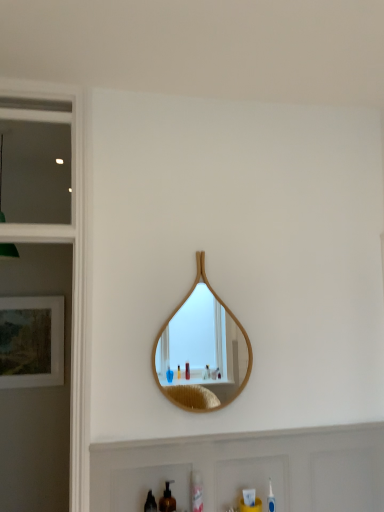
Question: Does point (200, 339) appear closer or farther from the camera than point (167, 501)?

Choices:
 (A) farther
 (B) closer

Answer: (A)

Question: From their relative heights in the image, would you say wooden mirror at center is taller or shorter than brown matte soap dispenser at lower center?

Choices:
 (A) tall
 (B) short

Answer: (A)

Question: Estimate the real-world distances between objects in this image. Which object is farther from the wooden mirror at center?

Choices:
 (A) brown matte soap dispenser at lower center
 (B) white matte cabinet at lower center
 (C) clear plastic mouthwash at lower center, which is counted as the first mouthwash, starting from the back
 (D) matte wooden picture frame at left
 (E) clear glass window at upper left

Answer: (E)

Question: Which object is positioned farthest from the black plastic mouthwash at lower center, acting as the first mouthwash starting from the left?

Choices:
 (A) clear plastic mouthwash at lower center, which is counted as the first mouthwash, starting from the back
 (B) white matte cabinet at lower center
 (C) wooden mirror at center
 (D) clear glass window at upper left
 (E) brown matte soap dispenser at lower center

Answer: (C)